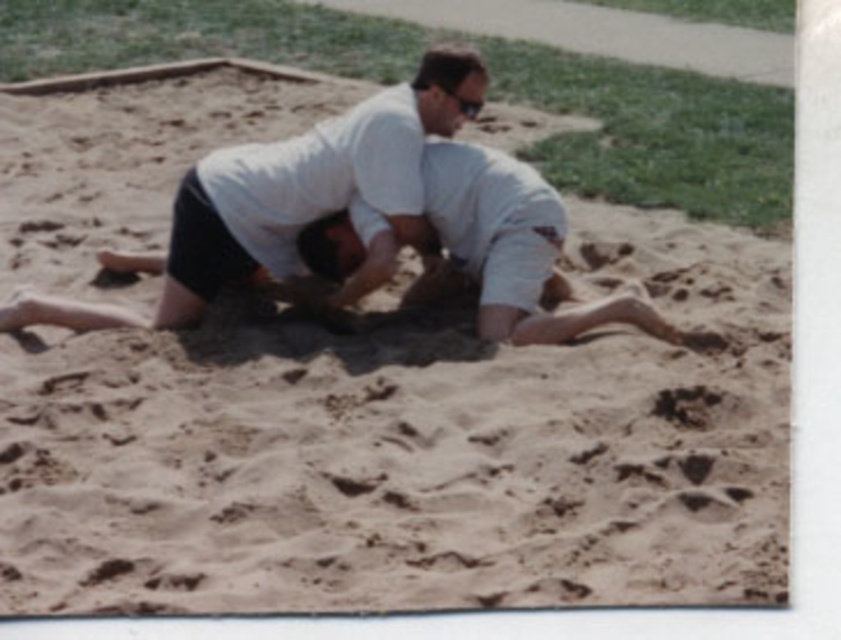
Between white matte shirt at center and white cotton shirt at center, which one appears on the left side from the viewer's perspective?

From the viewer's perspective, white matte shirt at center appears more on the left side.

Does white matte shirt at center have a lesser width compared to white cotton shirt at center?

No.

Who is more forward, [299,157] or [572,294]?

Point [299,157] is in front.

Identify the location of white matte shirt at center. (286, 200).